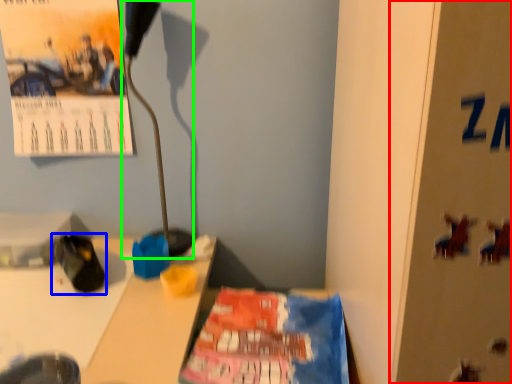
Question: Which object is the farthest from bulletin board (highlighted by a red box)? Choose among these: footwear (highlighted by a blue box) or lamp (highlighted by a green box).

Choices:
 (A) footwear
 (B) lamp

Answer: (B)